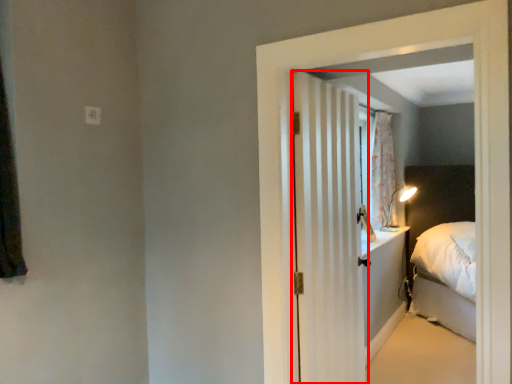
Question: Considering the relative positions of door (annotated by the red box) and electric outlet in the image provided, where is door (annotated by the red box) located with respect to the staircase?

Choices:
 (A) right
 (B) left

Answer: (A)